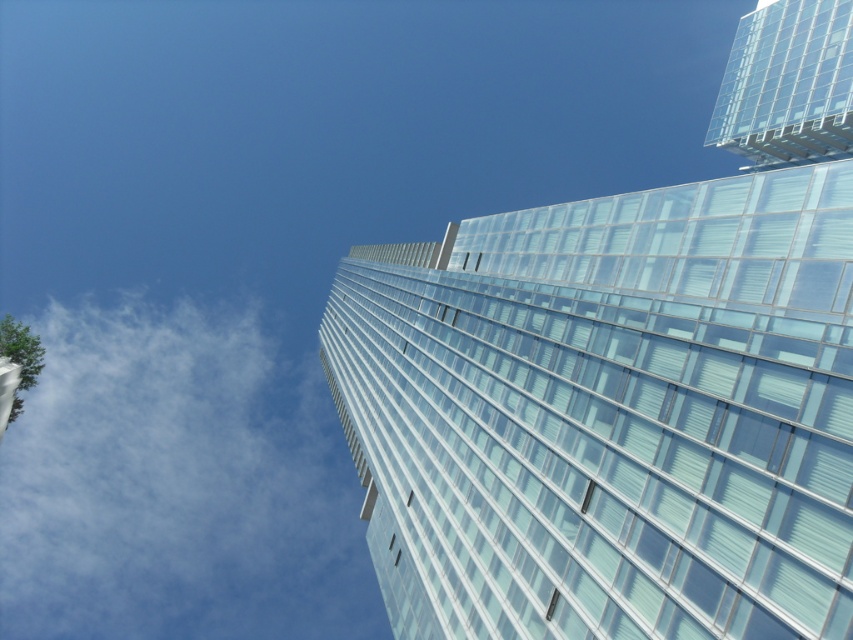
You are standing at the base of the modern glass skyscraper and looking up. There is a point marked at coordinates (178, 483) on the image. What object is located at that point?

The point at (178, 483) corresponds to a white fluffy cloud at upper left.

You are standing at the base of the transparent glass building at upper center and want to look at the transparent glass building at upper right. Which building appears bigger to you?

The transparent glass building at upper center appears bigger than the transparent glass building at upper right because it is larger in size.

You are an architect analyzing the image of the skyscraper. You notice the transparent glass building at upper center and the white fluffy cloud at upper left. Which object appears narrower in the image?

The transparent glass building at upper center is thinner than the white fluffy cloud at upper left, so it appears narrower in the image.